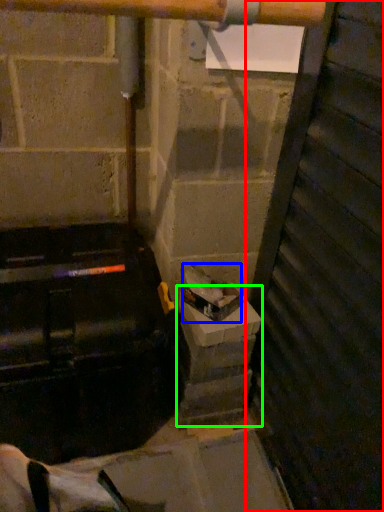
Question: Which is nearer to the door (highlighted by a red box)? garbage (highlighted by a blue box) or concrete (highlighted by a green box).

Choices:
 (A) garbage
 (B) concrete

Answer: (B)